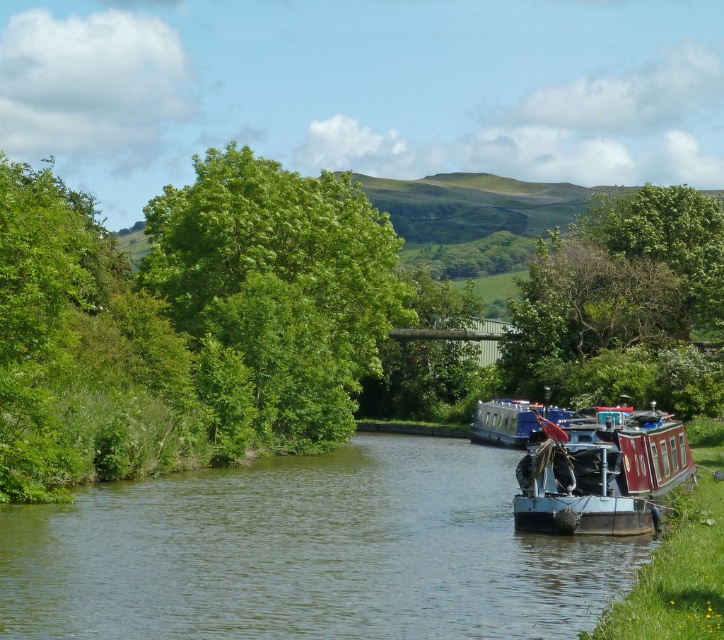
You are standing on the bank of the canal and want to reach a specific point marked at coordinates point (201, 268). If your maximum comfortable walking distance is 50 meters, can you comfortably reach that point without needing to take a boat?

The distance of point (201, 268) from viewer is 63.43 meters, which exceeds your maximum comfortable walking distance of 50 meters. Therefore, you would need to take a boat to reach that point.

You are standing on the dock near the two narrowboats and looking at the green leafy tree at center and the green leafy tree at upper center. Which tree is positioned higher in the image?

The green leafy tree at upper center is positioned higher in the image than the green leafy tree at center.